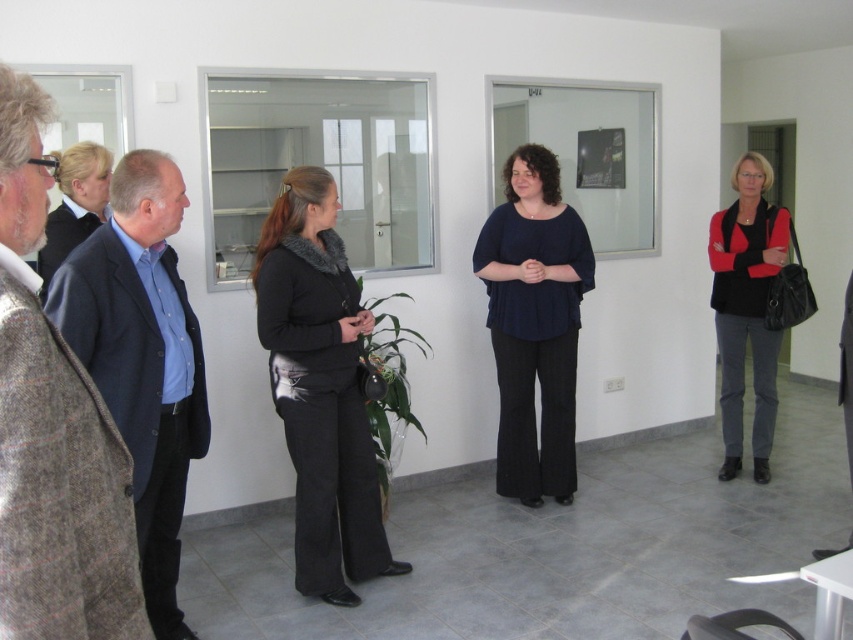
You are a photographer positioned in the center of the room. You want to capture a photo that includes both the blue shirt at left and the dark blue suit at left. Which clothing item will appear taller in the photo?

The dark blue suit at left appears taller in the photo because the blue shirt at left is not as tall as the dark blue suit at left.

You are a delivery robot with a package that needs to be delivered to the dark blue fabric blouse at center. You are currently positioned near the dark blue suit at left. The robot has a maximum delivery range of 2 meters before needing to recharge. Can you deliver the package without needing to recharge?

The distance between dark blue suit at left and dark blue fabric blouse at center is 1.81 meters, which is within the robot s 2 meter range. Therefore, the delivery can be made without needing to recharge.

You are an event planner arranging seating for a meeting. You need to place a name tag for the person in the blue shirt at left and the person in the matte black sweater at right. Based on their positions in the image, which name tag should be placed further to the left?

The blue shirt at left is positioned on the left side of the matte black sweater at right, so the name tag for the blue shirt at left should be placed further to the left.